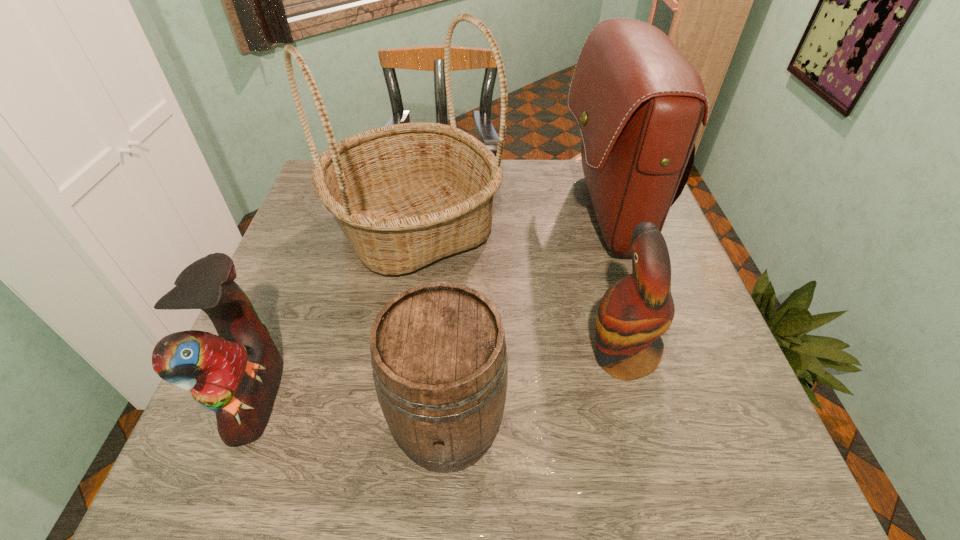
Image resolution: width=960 pixels, height=540 pixels. What are the coordinates of `parrot present at the right edge` in the screenshot? It's located at click(634, 313).

Locate an element on the screen. Image resolution: width=960 pixels, height=540 pixels. object at the far left corner is located at coordinates (406, 195).

Locate an element on the screen. Image resolution: width=960 pixels, height=540 pixels. object at the near left corner is located at coordinates (237, 373).

In order to click on object at the far right corner in this screenshot , I will do `click(638, 101)`.

Find the location of a particular element. This screenshot has height=540, width=960. free space at the far edge is located at coordinates (560, 168).

Image resolution: width=960 pixels, height=540 pixels. In the image, there is a desktop. In order to click on vacant space at the left edge in this screenshot , I will do `click(293, 414)`.

This screenshot has width=960, height=540. I want to click on free space at the right edge of the desktop, so click(x=707, y=373).

Locate an element on the screen. The height and width of the screenshot is (540, 960). empty space between the right parrot and the basket is located at coordinates (518, 292).

Where is `vacant region between the cider and the right parrot`? vacant region between the cider and the right parrot is located at coordinates (535, 390).

Identify the location of free space between the basket and the right parrot. This screenshot has width=960, height=540. (518, 292).